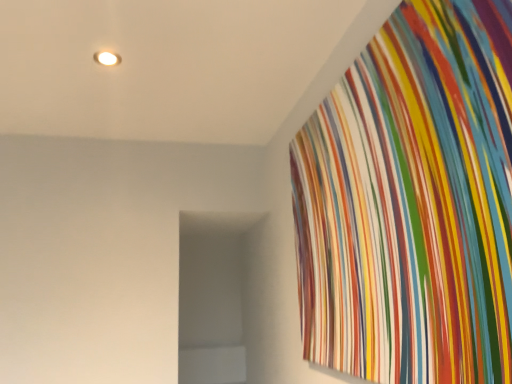
This screenshot has width=512, height=384. What do you see at coordinates (408, 210) in the screenshot?
I see `multicolored striped fabric at upper right` at bounding box center [408, 210].

Find the location of a particular element. This screenshot has width=512, height=384. multicolored striped fabric at upper right is located at coordinates (408, 210).

You are a GUI agent. You are given a task and a screenshot of the screen. Output one action in this format:
    pyautogui.click(x=<x>, y=<y>)
    Task: Click on the multicolored striped fabric at upper right
    This screenshot has height=384, width=512.
    Given the screenshot: What is the action you would take?
    pyautogui.click(x=408, y=210)